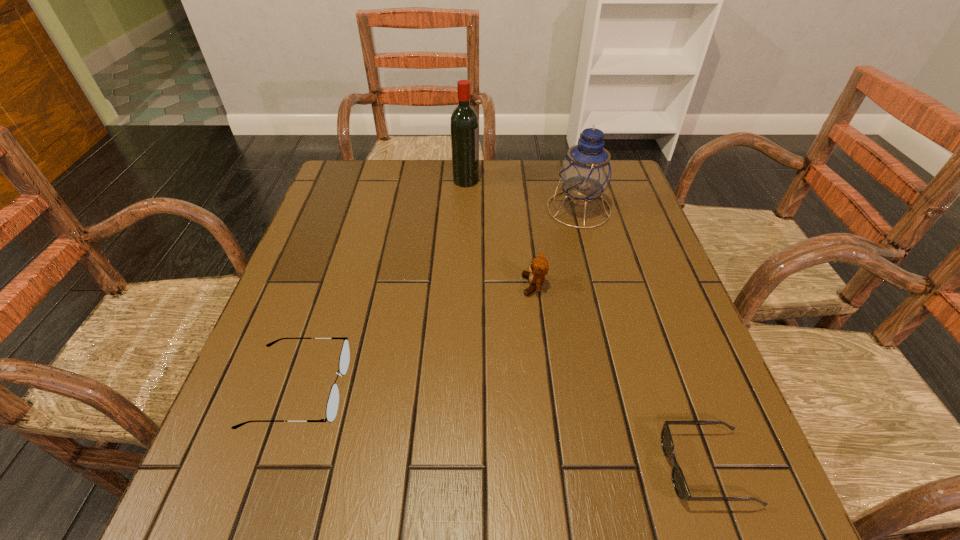
Where is `wine bottle that is at the far edge`? wine bottle that is at the far edge is located at coordinates (464, 123).

Identify the location of lantern at the far edge. (585, 173).

Locate an element on the screen. object located at the near edge is located at coordinates (680, 485).

Find the location of `object that is at the left edge`. object that is at the left edge is located at coordinates (x=332, y=405).

This screenshot has height=540, width=960. What are the coordinates of `lantern that is at the right edge` in the screenshot? It's located at (585, 173).

Identify the location of sunglasses that is at the right edge. Image resolution: width=960 pixels, height=540 pixels. (680, 485).

Locate an element on the screen. The width and height of the screenshot is (960, 540). object present at the far right corner is located at coordinates (585, 173).

Locate an element on the screen. This screenshot has height=540, width=960. object at the near right corner is located at coordinates (680, 485).

This screenshot has height=540, width=960. In order to click on free space at the far edge of the desktop in this screenshot , I will do `click(482, 170)`.

Locate an element on the screen. The width and height of the screenshot is (960, 540). vacant region at the near edge of the desktop is located at coordinates (512, 476).